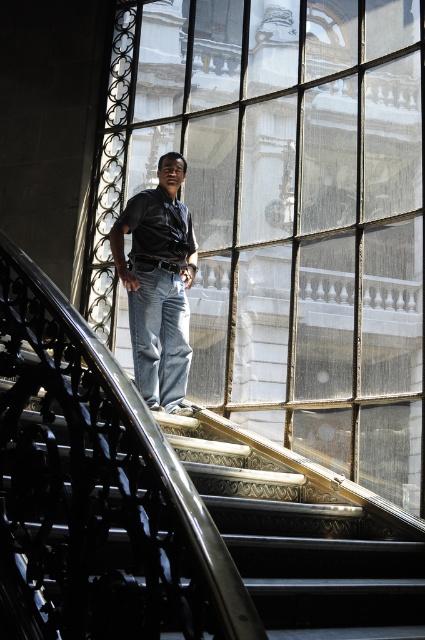
You are a photographer trying to capture a shot of the matte black shirt at center and the clear glass window at center. Which object is closer to the camera lens?

The clear glass window at center is closer to the viewer than the matte black shirt at center, so the window will appear closer to the camera lens.

You are a photographer trying to capture the man standing on the staircase. You notice the clear glass window at center and the matte black shirt at center. Which object is located above the other?

The clear glass window at center is positioned over matte black shirt at center, so the window is above the shirt.